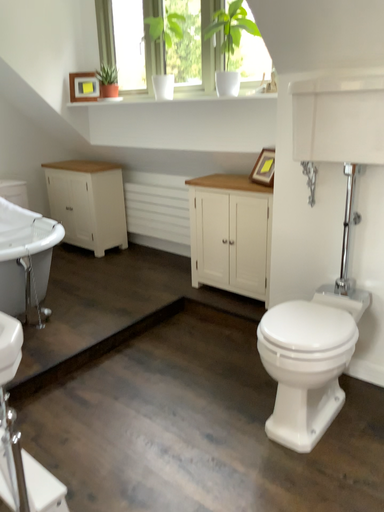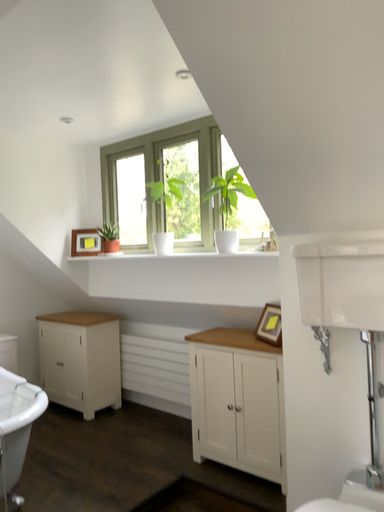
Question: Which way did the camera rotate in the video?

Choices:
 (A) rotated downward
 (B) rotated upward

Answer: (B)